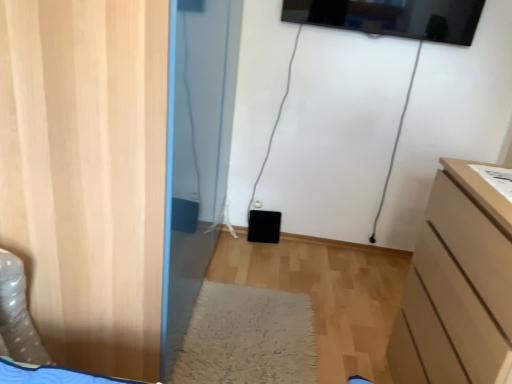
Question: Is matte beige chest of drawers at right inside or outside of wooden door at left?

Choices:
 (A) outside
 (B) inside

Answer: (A)

Question: Based on their sizes in the image, would you say matte beige chest of drawers at right is bigger or smaller than wooden door at left?

Choices:
 (A) small
 (B) big

Answer: (A)

Question: Based on their relative distances, which object is nearer to the matte beige chest of drawers at right?

Choices:
 (A) white shaggy rug at center
 (B) wooden door at left

Answer: (A)

Question: Which object is the closest to the wooden door at left?

Choices:
 (A) matte beige chest of drawers at right
 (B) white shaggy rug at center

Answer: (B)